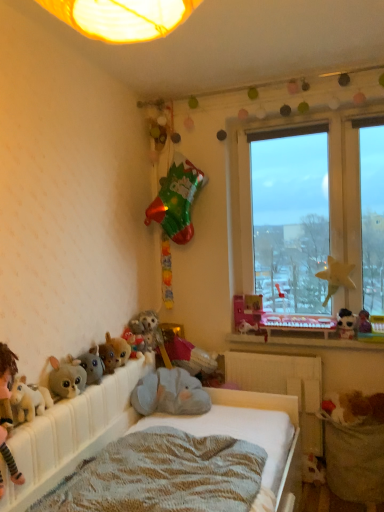
Question: Does point (11, 404) appear closer or farther from the camera than point (289, 367)?

Choices:
 (A) closer
 (B) farther

Answer: (A)

Question: From the image's perspective, is fluffy plush toy at lower left, acting as the 8th toy starting from the right, located above or below white plastic radiator at center?

Choices:
 (A) above
 (B) below

Answer: (A)

Question: Which is farther from the fluffy plush toy at lower left, the first toy in the left-to-right sequence?

Choices:
 (A) fluffy plush elephant at center, which is the 7th toy in left-to-right order
 (B) yellow fabric star at window, which ranks as the second miniature in bottom-to-top order
 (C) transparent glass window at upper right
 (D) soft plush bed at lower left
 (E) knitted fabric mattress at lower center

Answer: (B)

Question: Which of these objects is positioned closest to the white plastic radiator at center?

Choices:
 (A) fluffy plush toys at lower left, placed as the second toy when sorted from left to right
 (B) fluffy plush toy at center, which is the 4th toy in right-to-left order
 (C) white plush toy at right, which appears as the second miniature when viewed from the top
 (D) fluffy plush toy at lower left, which appears as the 3th toy when viewed from the left
 (E) fluffy plush elephant at center, which is the 7th toy in left-to-right order

Answer: (E)